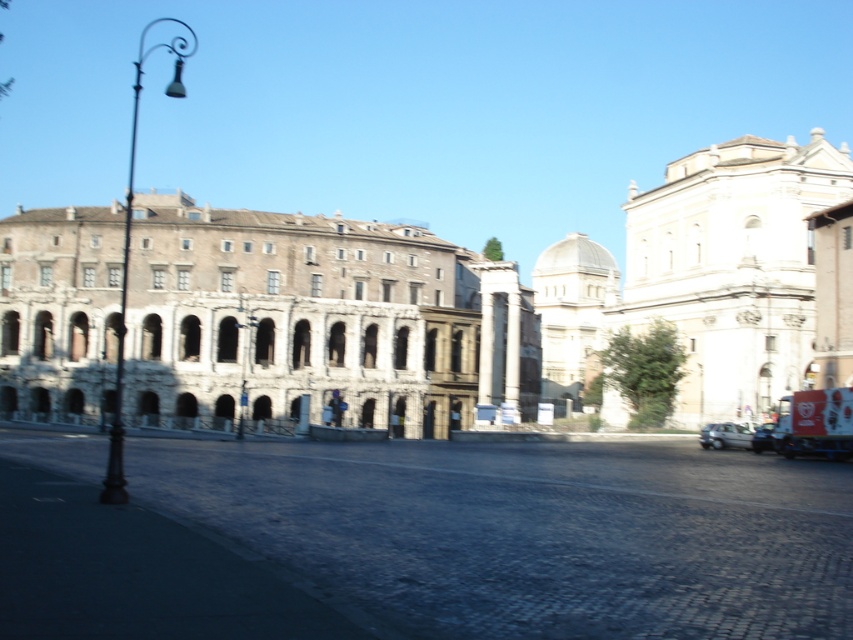
Between point (712, 432) and point (758, 436), which one is positioned behind?

Positioned behind is point (712, 432).

Does silver metallic car at lower right have a greater height compared to metallic silver car at lower right?

Incorrect, silver metallic car at lower right's height is not larger of metallic silver car at lower right's.

This screenshot has width=853, height=640. Describe the element at coordinates (724, 435) in the screenshot. I see `silver metallic car at lower right` at that location.

Identify the location of silver metallic car at lower right. (724, 435).

In the scene shown: Does stone/brick building at center have a greater height compared to metallic silver car at lower right?

Yes, stone/brick building at center is taller than metallic silver car at lower right.

Where is `stone/brick building at center`? Image resolution: width=853 pixels, height=640 pixels. stone/brick building at center is located at coordinates (315, 321).

Is stone/brick building at center above beige stone building at upper right?

No, stone/brick building at center is not above beige stone building at upper right.

Does stone/brick building at center have a lesser height compared to beige stone building at upper right?

Yes.

This screenshot has height=640, width=853. What are the coordinates of `stone/brick building at center` in the screenshot? It's located at (315, 321).